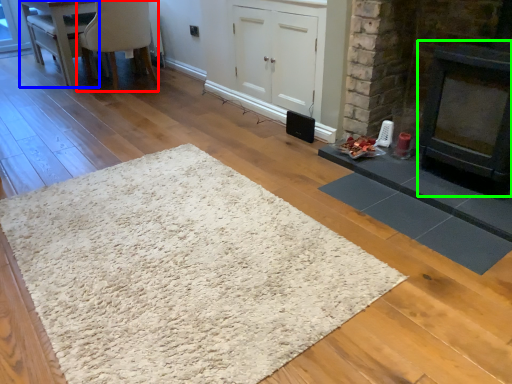
Question: Which object is the farthest from chair (highlighted by a red box)? Choose among these: table (highlighted by a blue box) or fireplace (highlighted by a green box).

Choices:
 (A) table
 (B) fireplace

Answer: (B)